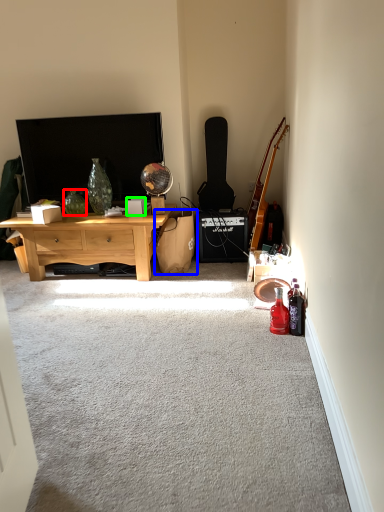
Question: Which is farther away from vase (highlighted by a red box)? handbag (highlighted by a blue box) or box (highlighted by a green box)?

Choices:
 (A) handbag
 (B) box

Answer: (A)